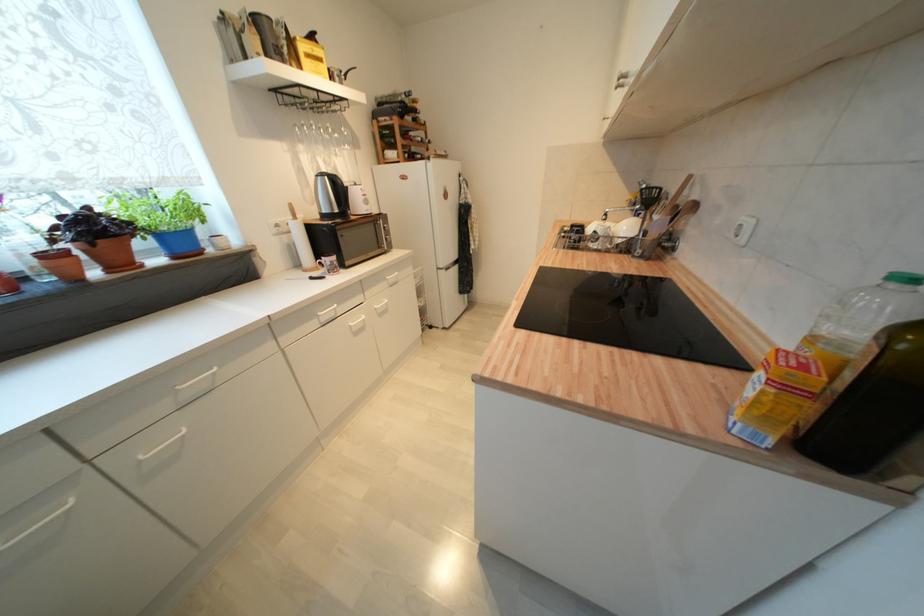
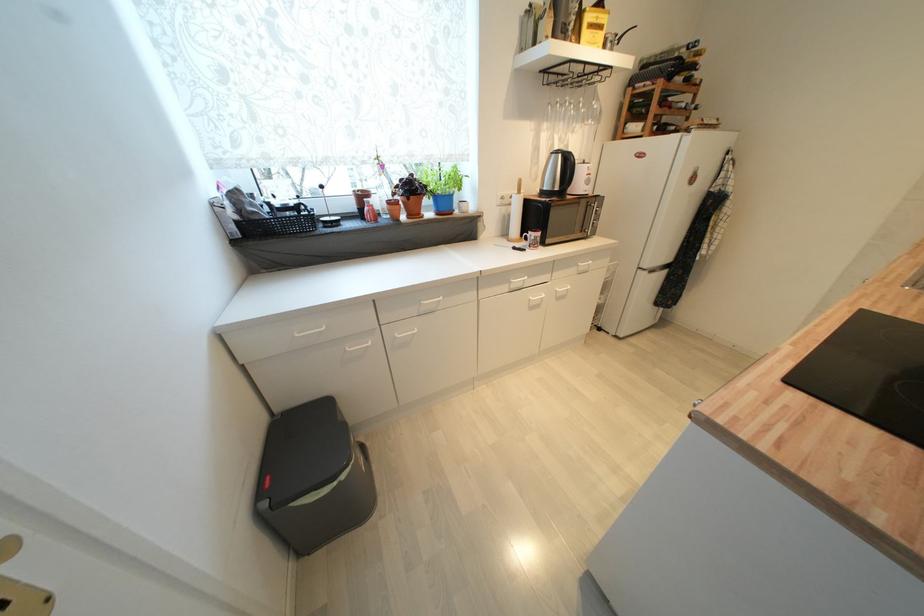
In the second image, find the point that corresponds to [359,331] in the first image.

(536, 306)